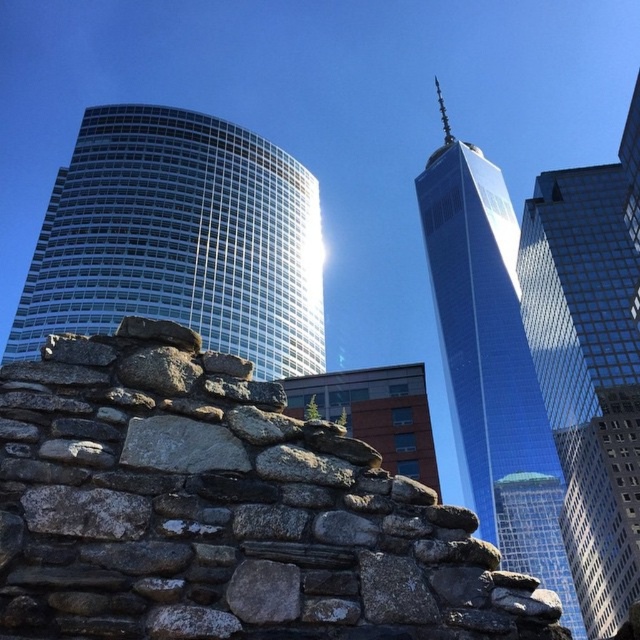
You are standing in front of the scene and want to take a photo that includes both the curved skyscraper on the left and the tall, slender building on the right. However, you notice two points marked at coordinates point (80, 532) and point (604, 374). Which of these points is closer to your camera position?

Point (80, 532) is closer to the camera than point (604, 374).

You are standing in front of the gray rough stone wall at center and the glassy blue skyscraper at center. Which object is nearer to you?

The gray rough stone wall at center is closer to the viewer than the glassy blue skyscraper at center.